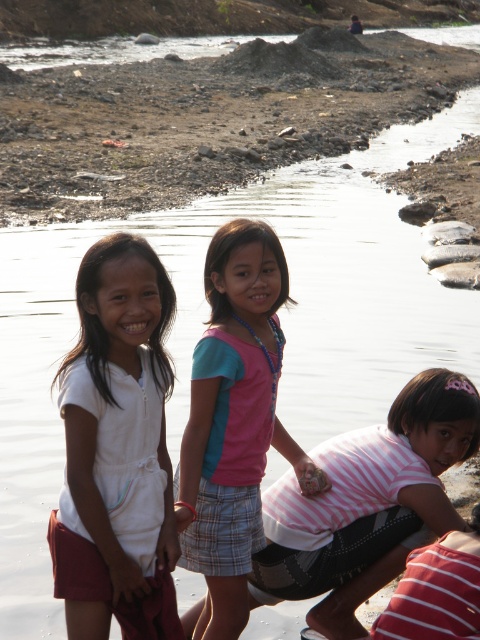
Question: Which object is the closest to the striped cotton shirt at center?

Choices:
 (A) dull brown dirt at upper center
 (B) pink fabric shirt at center
 (C) white cotton dress at center

Answer: (B)

Question: Can you confirm if dull brown dirt at upper center is positioned below white cotton dress at center?

Choices:
 (A) yes
 (B) no

Answer: (B)

Question: Is dull brown dirt at upper center thinner than pink fabric shirt at center?

Choices:
 (A) no
 (B) yes

Answer: (A)

Question: Among these points, which one is nearest to the camera?

Choices:
 (A) coord(106,179)
 (B) coord(398,404)
 (C) coord(124,253)
 (D) coord(265,282)

Answer: (C)

Question: Which of the following is the closest to the observer?

Choices:
 (A) (248, 504)
 (B) (397, 412)
 (C) (101, 378)

Answer: (C)

Question: Is white cotton dress at center further to the viewer compared to striped cotton shirt at center?

Choices:
 (A) no
 (B) yes

Answer: (A)